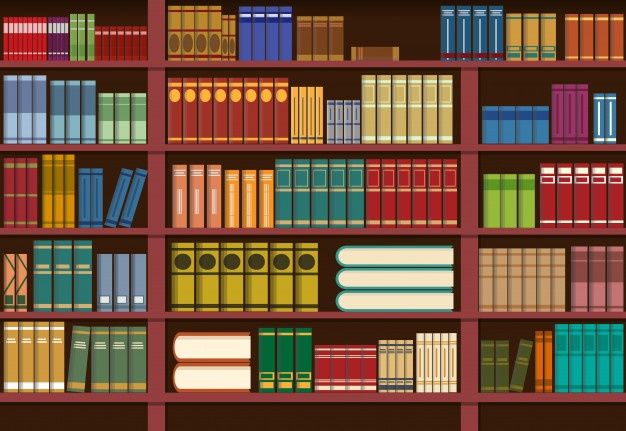
At what (x,y) coordinates should I click in order to perform the action: click on computer generated books on left second shelf. Please return your answer as a coordinate pair (x, y). The height and width of the screenshot is (431, 626). Looking at the image, I should click on (8, 119), (21, 122), (36, 125), (53, 125), (71, 125), (85, 128), (105, 128), (121, 128), (140, 127).